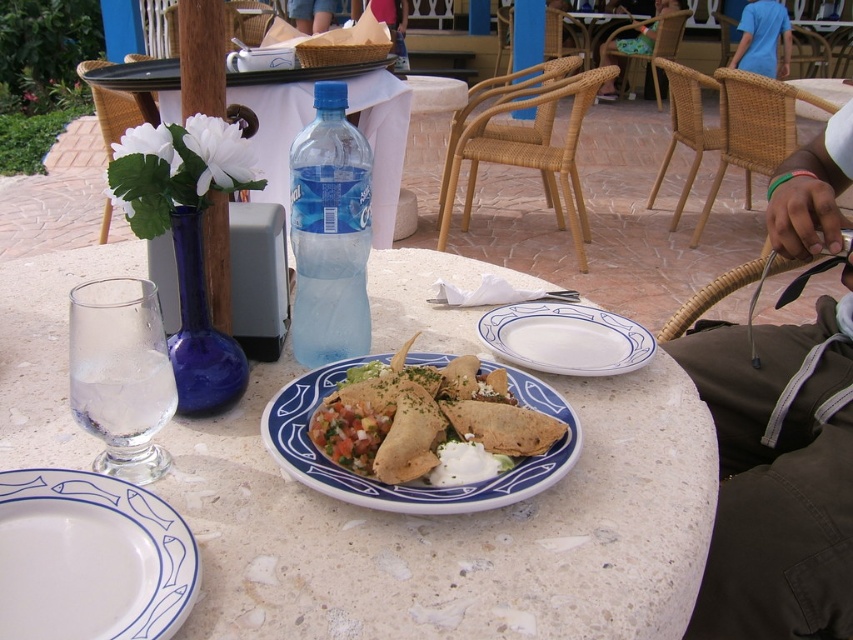
You are standing at the edge of the dining table and want to place a napkin between the two points labeled point (604, 566) and point (323, 138). Which point should you move towards first to reach the area between them?

You should move towards point (323, 138) first because point (604, 566) is in front of point (323, 138), meaning point (323, 138) is closer to you and the napkin should be placed between them by starting from the closer point.

You are a waiter at the outdoor dining area and need to place a 12 inch long tray on the table. The tray must be placed between the brown fabric pants at lower right and the clear glass at center. Is there enough space for the tray?

The brown fabric pants at lower right is 29.35 inches from the clear glass at center. Since the tray is 12 inches long, there is sufficient space between them to place the tray.

You are a waiter at the outdoor dining area and need to place a new menu between the white marble plate at center and the translucent plastic bottle at center. Based on their positions, which object should you place the menu closer to?

You should place the menu closer to the translucent plastic bottle at center because the white marble plate at center is to the left of the translucent plastic bottle at center, meaning the bottle is to the right of the plate. Therefore, placing the menu closer to the bottle would be between them.